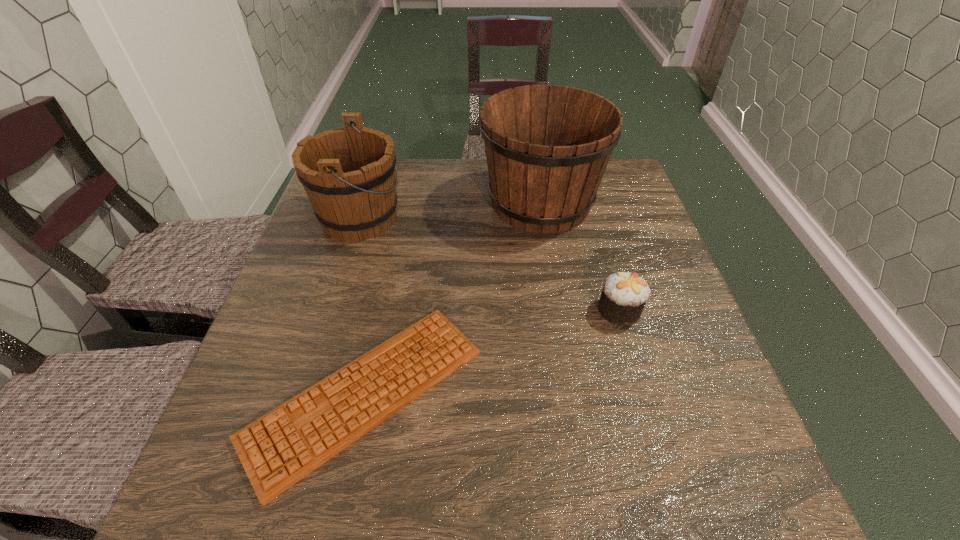
Identify the location of computer keyboard situated at the left edge. (280, 448).

You are a GUI agent. You are given a task and a screenshot of the screen. Output one action in this format:
    pyautogui.click(x=<x>, y=<y>)
    Task: Click on the wine bucket that is at the right edge
    
    Given the screenshot: What is the action you would take?
    pyautogui.click(x=547, y=146)

Image resolution: width=960 pixels, height=540 pixels. Find the location of `cupcake that is at the right edge`. cupcake that is at the right edge is located at coordinates (624, 295).

This screenshot has width=960, height=540. Find the location of `object that is at the far left corner`. object that is at the far left corner is located at coordinates (348, 173).

At what (x,y) coordinates should I click in order to perform the action: click on object that is positioned at the near left corner. Please return your answer as a coordinate pair (x, y). Looking at the image, I should click on point(280,448).

At what (x,y) coordinates should I click in order to perform the action: click on object that is at the far right corner. Please return your answer as a coordinate pair (x, y). The width and height of the screenshot is (960, 540). Looking at the image, I should click on (547, 146).

Where is `vacant space at the near edge`? vacant space at the near edge is located at coordinates (421, 501).

What are the coordinates of `free space at the left edge` in the screenshot? It's located at (264, 404).

At what (x,y) coordinates should I click in order to perform the action: click on free space at the right edge of the desktop. Please return your answer as a coordinate pair (x, y). Looking at the image, I should click on (666, 336).

At what (x,y) coordinates should I click in order to perform the action: click on blank space at the far right corner of the desktop. Please return your answer as a coordinate pair (x, y). Looking at the image, I should click on (619, 191).